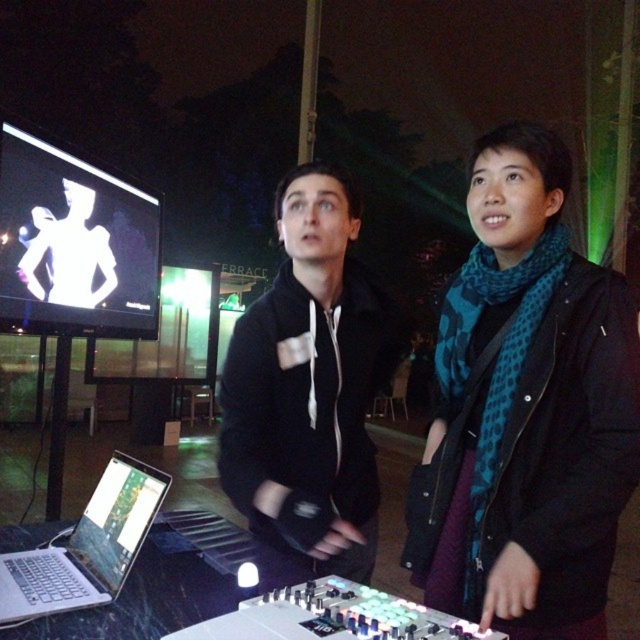
You are at a tech event and see two people in front of you. One is wearing a black matte jacket at center and the other has a teal dotted scarf at center. If you want to approach the person on the left side, which clothing item should you look for?

The black matte jacket at center is to the left of the teal dotted scarf at center, so you should approach the person wearing the black matte jacket at center.

You are at a tech event and need to take a photo of the teal dotted scarf at center and the black matte jacket at center. Which object should you focus on first if you want to capture both in the same frame without moving the camera?

The teal dotted scarf at center is taller than the black matte jacket at center, so you should focus on the teal dotted scarf at center first to ensure both objects are in frame.

You are a photographer at the event and need to capture a clear shot of the metallic silver laptop at lower left without the black matte jacket at center blocking it. Based on their positions, is this possible?

The black matte jacket at center is positioned over the metallic silver laptop at lower left, so it is blocking the view. To capture a clear shot of the metallic silver laptop at lower left, you would need to adjust your angle or have the person move to ensure the jacket is no longer covering the laptop.